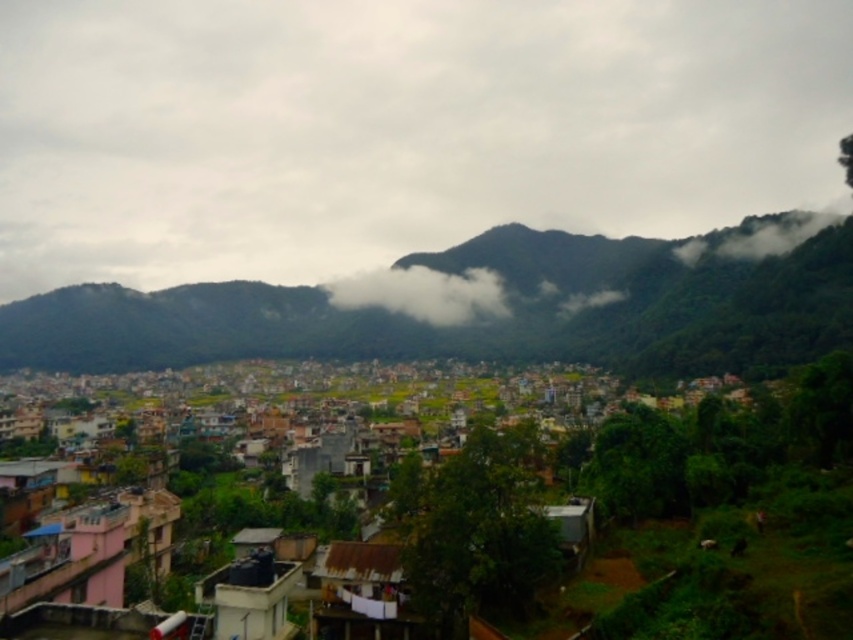
You are navigating a drone over an urban area surrounded by green mountains. Your mission is to deliver a package to the multicolored buildings at center. According to the coordinates provided, where should you direct the drone to land?

The multicolored buildings at center are located at point (338, 433), so you should direct the drone to land there.

You are a drone operator tasked with capturing aerial footage of the green forested mountain at center and the white fluffy cloud at center. The drone has a maximum flight range of 60 meters. Can the drone safely capture footage of both objects without exceeding its range?

The green forested mountain at center is 63.51 meters away from the white fluffy cloud at center. Since the drone has a maximum flight range of 60 meters, it cannot safely capture footage of both objects without exceeding its range.